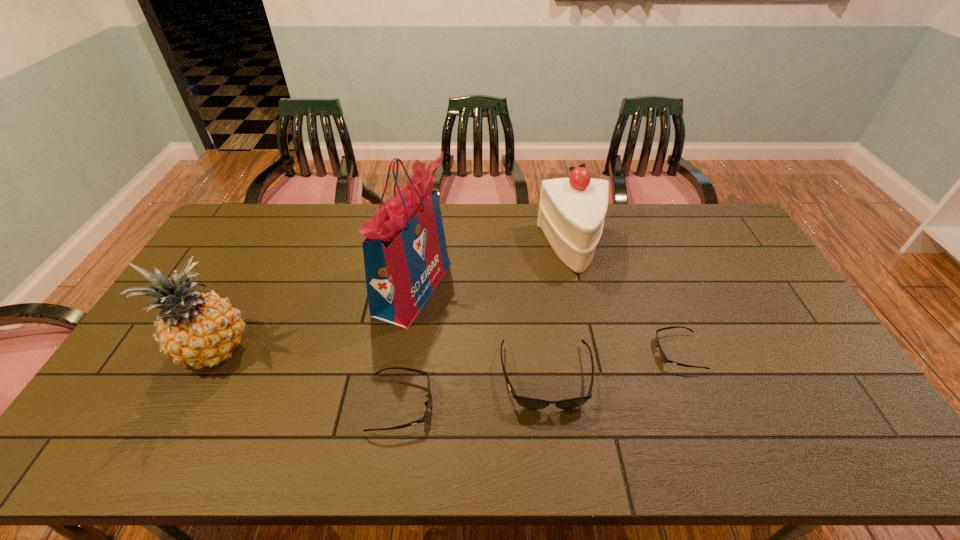
Find the location of `vacant position in the image that satisfies the following two spatial constraints: 1. on the front-facing side of the third shortest object; 2. on the front-facing side of the second shortest sunglasses`. vacant position in the image that satisfies the following two spatial constraints: 1. on the front-facing side of the third shortest object; 2. on the front-facing side of the second shortest sunglasses is located at coordinates (549, 404).

Locate an element on the screen. free space that satisfies the following two spatial constraints: 1. on the front-facing side of the shortest object; 2. on the front-facing side of the tallest sunglasses is located at coordinates (687, 377).